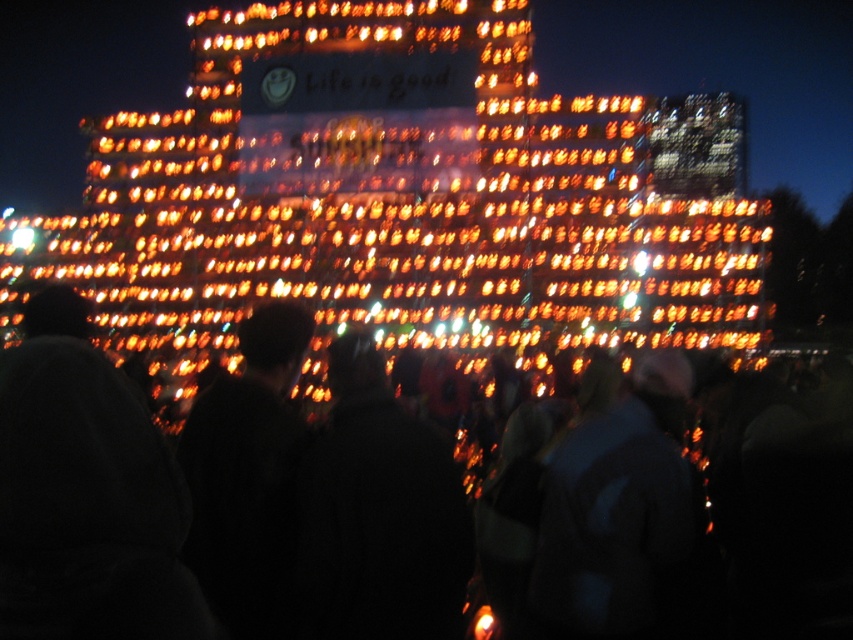
You are standing in the crowd observing the light display. You notice a black fuzzy hat at lower left and a black matte jacket at center. Which object is nearer to you?

The black fuzzy hat at lower left is closer to the viewer than the black matte jacket at center.

You are a photographer trying to capture a photo of the light display. You notice two people in the crowd wearing jackets with different colors. The black matte jacket at center and the dark blue jacket at center. To ensure both jackets are in focus, what is the minimum distance you should set your camera lens to focus on?

The black matte jacket at center and dark blue jacket at center are 13.60 meters apart from each other. To ensure both are in focus, the camera lens should be focused at the midpoint between them, which would be approximately 6.80 meters from the camera.